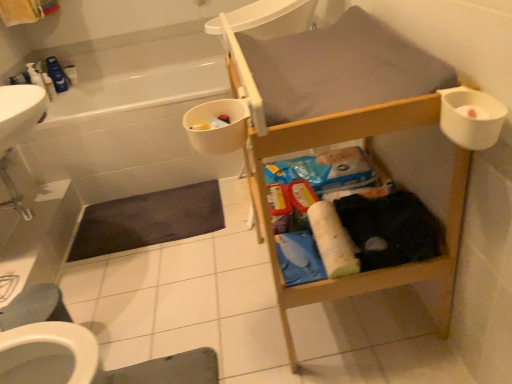
Where is `free area behind gray fabric bath mat at lower center, which is the first bath mat in front-to-back order`? This screenshot has width=512, height=384. free area behind gray fabric bath mat at lower center, which is the first bath mat in front-to-back order is located at coordinates (166, 315).